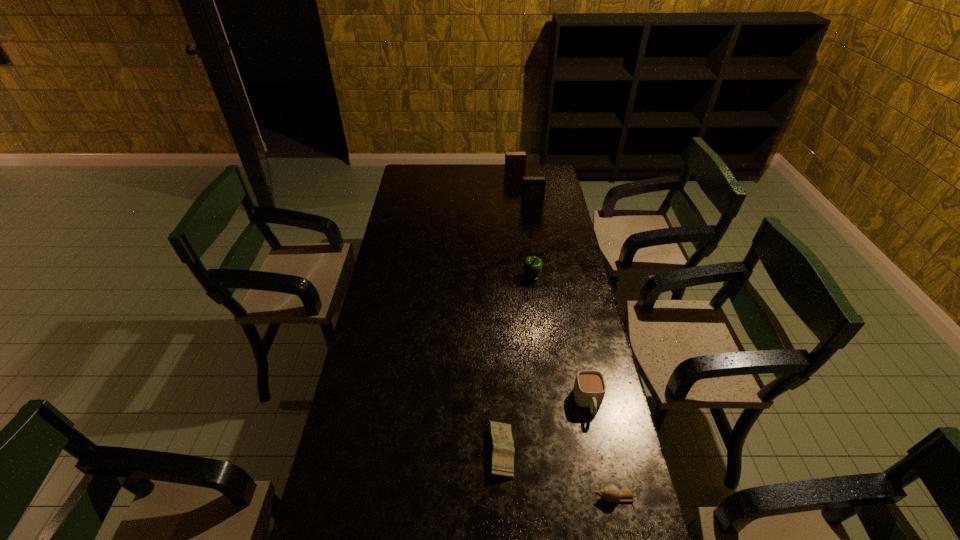
Find the location of a particular element. The image size is (960, 540). cup at the right edge is located at coordinates (589, 388).

In order to click on escargot located at the right edge in this screenshot , I will do `click(610, 492)`.

Where is `free location at the far edge of the desktop`? The width and height of the screenshot is (960, 540). free location at the far edge of the desktop is located at coordinates (456, 169).

Locate an element on the screen. The height and width of the screenshot is (540, 960). free spot at the left edge of the desktop is located at coordinates (383, 286).

Image resolution: width=960 pixels, height=540 pixels. What are the coordinates of `vacant region at the right edge of the desktop` in the screenshot? It's located at (584, 509).

Where is `free space at the far left corner of the desktop`? The width and height of the screenshot is (960, 540). free space at the far left corner of the desktop is located at coordinates (410, 184).

The width and height of the screenshot is (960, 540). In order to click on free area in between the second farthest diary and the nearest object in this screenshot , I will do `click(574, 350)`.

The height and width of the screenshot is (540, 960). I want to click on vacant region between the nearest object and the shortest diary, so click(x=559, y=474).

The height and width of the screenshot is (540, 960). Identify the location of free space between the nearest object and the nearest diary. (559, 474).

The width and height of the screenshot is (960, 540). I want to click on vacant point located between the third farthest object and the nearest diary, so click(516, 364).